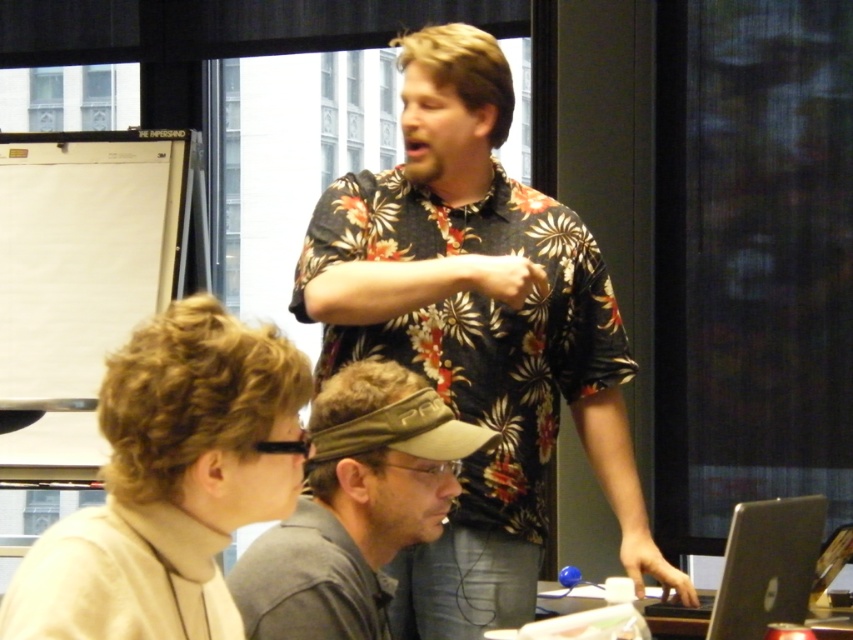
Question: Does floral print shirt at center appear on the right side of silver metallic laptop at lower right?

Choices:
 (A) no
 (B) yes

Answer: (A)

Question: Which is nearer to the floral print shirt at center?

Choices:
 (A) silver metallic laptop at lower right
 (B) beige turtleneck sweater at lower left

Answer: (A)

Question: Among these objects, which one is nearest to the camera?

Choices:
 (A) floral print shirt at center
 (B) silver metallic laptop at lower right
 (C) beige turtleneck sweater at lower left

Answer: (C)

Question: Observing the image, what is the correct spatial positioning of floral print shirt at center in reference to beige turtleneck sweater at lower left?

Choices:
 (A) above
 (B) below

Answer: (A)

Question: Does gray fabric cap at center appear under silver metallic laptop at lower right?

Choices:
 (A) yes
 (B) no

Answer: (B)

Question: Which of the following is the closest to the observer?

Choices:
 (A) (422, 412)
 (B) (819, 515)

Answer: (A)